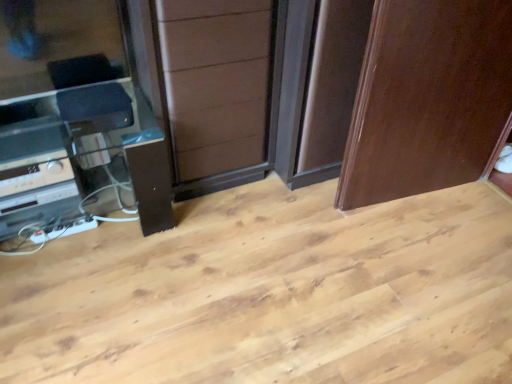
Locate an element on the screen. free spot below satin black entertainment center at left (from a real-world perspective) is located at coordinates (86, 234).